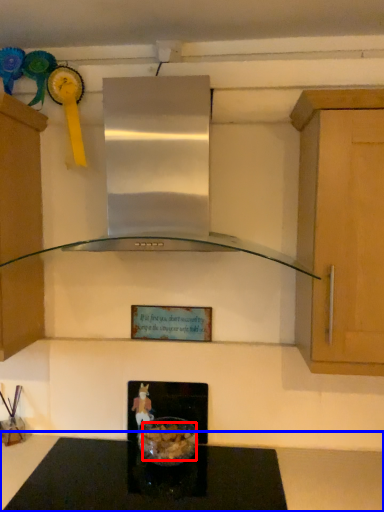
Question: Which object appears closest to the camera in this image, food (highlighted by a red box) or countertop (highlighted by a blue box)?

Choices:
 (A) food
 (B) countertop

Answer: (B)